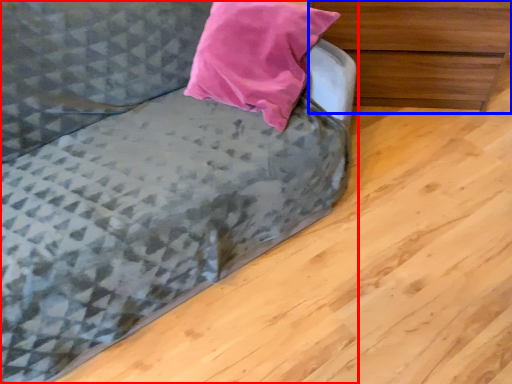
Question: Which point is further to the camera, studio couch (highlighted by a red box) or chest of drawers (highlighted by a blue box)?

Choices:
 (A) studio couch
 (B) chest of drawers

Answer: (B)